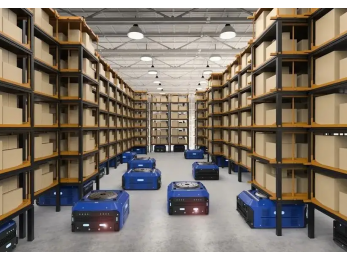
At what (x,y) coordinates should I click in order to perform the action: click on right side ceiling lamp. Please return your answer as a coordinate pair (x, y). Looking at the image, I should click on (227, 32), (214, 57), (206, 73), (204, 82), (201, 88).